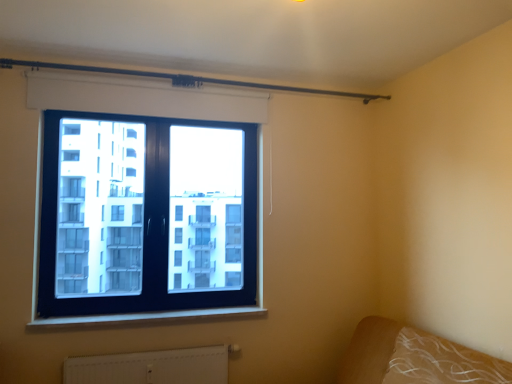
Question: Considering the positions of white plastic window sill at lower center and black glass window at upper left in the image, is white plastic window sill at lower center wider or thinner than black glass window at upper left?

Choices:
 (A) thin
 (B) wide

Answer: (B)

Question: From a real-world perspective, relative to black glass window at upper left, is white plastic window sill at lower center vertically above or below?

Choices:
 (A) below
 (B) above

Answer: (A)

Question: Based on their relative distances, which object is nearer to the black glass window at upper left?

Choices:
 (A) brown fabric bed at lower right
 (B) metallic rod at upper center
 (C) white textured radiator at lower center
 (D) white plastic window sill at lower center

Answer: (B)

Question: Which of these objects is positioned closest to the white plastic window sill at lower center?

Choices:
 (A) white textured radiator at lower center
 (B) metallic rod at upper center
 (C) black glass window at upper left
 (D) brown fabric bed at lower right

Answer: (A)